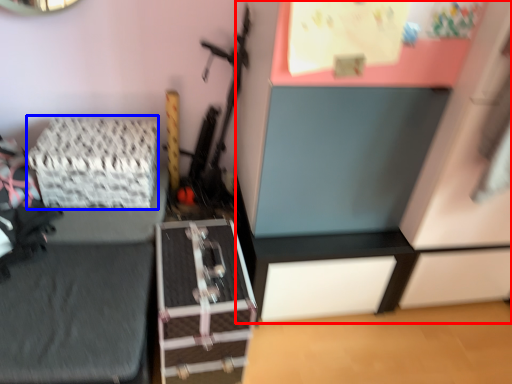
Question: Which object is further to the camera taking this photo, dresser (highlighted by a red box) or package (highlighted by a blue box)?

Choices:
 (A) dresser
 (B) package

Answer: (B)